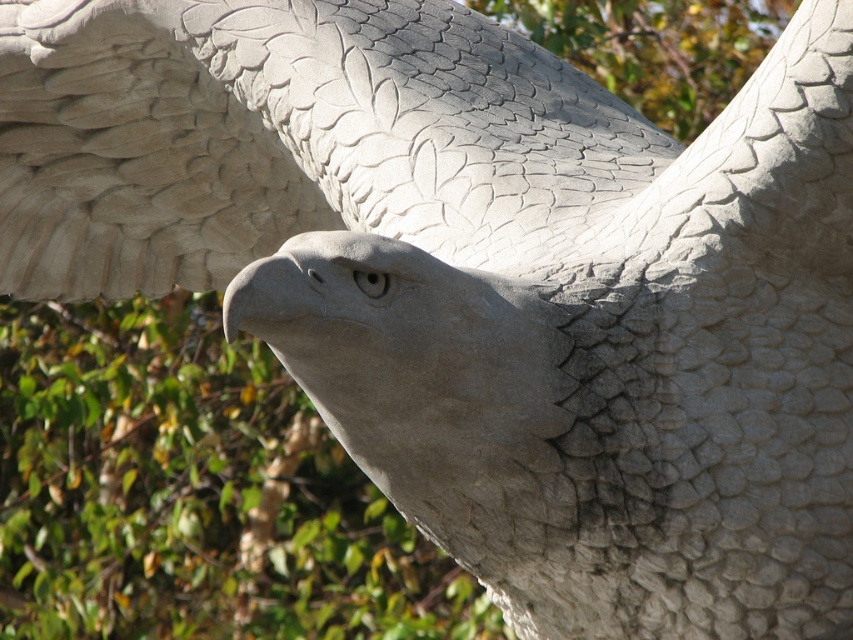
You are a photographer trying to capture the gray stone wing at upper left and the green leafy tree at center in a single shot. Based on their positions, which object will appear closer to the camera in the photo?

The gray stone wing at upper left will appear closer to the camera because it is positioned in front of the green leafy tree at center.

You are an art student analyzing the sculpture. You notice the gray stone wing at upper left and the green leafy tree at center. Which object appears closer to the viewer in the image?

The gray stone wing at upper left appears closer to the viewer because it is positioned over the green leafy tree at center, indicating it is in front.

You are standing in front of the eagle sculpture and want to take a photo of its gray stone wing at upper left. Based on the sculpture layout, where should you position yourself to capture the wing at coordinate point 0.219, 0.342?

You should position yourself to the lower right side of the sculpture to capture the gray stone wing at upper left at coordinate point (291, 140).